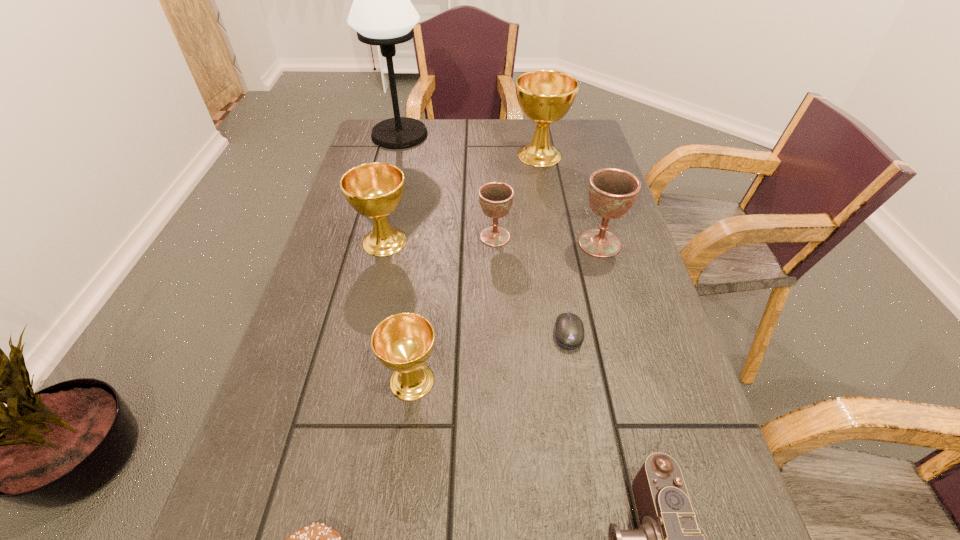
Locate an element on the screen. The height and width of the screenshot is (540, 960). chalice at the far edge is located at coordinates (545, 96).

The width and height of the screenshot is (960, 540). Find the location of `table lamp situated at the left edge`. table lamp situated at the left edge is located at coordinates (382, 14).

Find the location of a particular element. The width and height of the screenshot is (960, 540). chalice located at the left edge is located at coordinates (374, 190).

Locate an element on the screen. object located in the far left corner section of the desktop is located at coordinates (382, 14).

You are a GUI agent. You are given a task and a screenshot of the screen. Output one action in this format:
    pyautogui.click(x=<x>, y=<y>)
    Task: Click on the object that is at the far right corner
    The width and height of the screenshot is (960, 540).
    Given the screenshot: What is the action you would take?
    click(545, 96)

This screenshot has height=540, width=960. In the image, there is a desktop. Identify the location of vacant space at the far edge. (445, 126).

Identify the location of free location at the left edge of the desktop. The height and width of the screenshot is (540, 960). pyautogui.click(x=325, y=389).

At what (x,y) coordinates should I click in order to perform the action: click on vacant space at the right edge of the desktop. Please return your answer as a coordinate pair (x, y). Looking at the image, I should click on (689, 393).

Find the location of a particular element. This screenshot has width=960, height=540. free space at the far left corner of the desktop is located at coordinates [x=377, y=153].

Identify the location of empty space that is in between the second tallest object and the computer mouse. (554, 244).